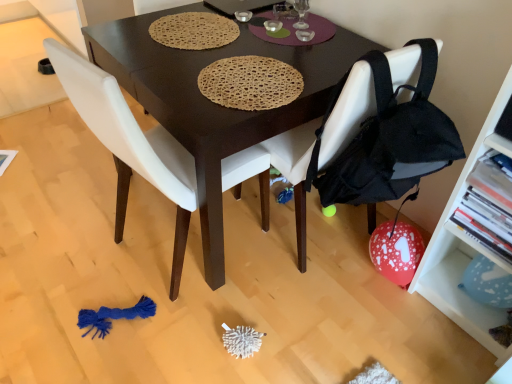
The width and height of the screenshot is (512, 384). Find the location of `vacant space that is in between black fabric chair at lower right, acting as the first chair starting from the right, and dark brown wood desk at center`. vacant space that is in between black fabric chair at lower right, acting as the first chair starting from the right, and dark brown wood desk at center is located at coordinates (290, 265).